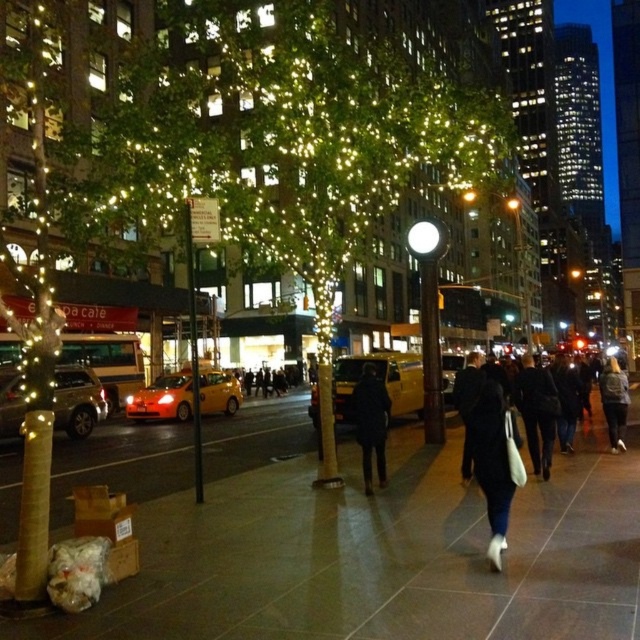
You are standing at the point marked by the coordinates point (371, 422) in the image. What object are you directly in front of?

The point (371, 422) corresponds to the dark blue coat at center.

You are a pedestrian standing on the sidewalk and see both the dark blue coat at center and the dark gray jacket at lower right. Which one is closer to the left side of the sidewalk?

The dark blue coat at center is closer to the left side of the sidewalk because it is positioned to the left of the dark gray jacket at lower right.